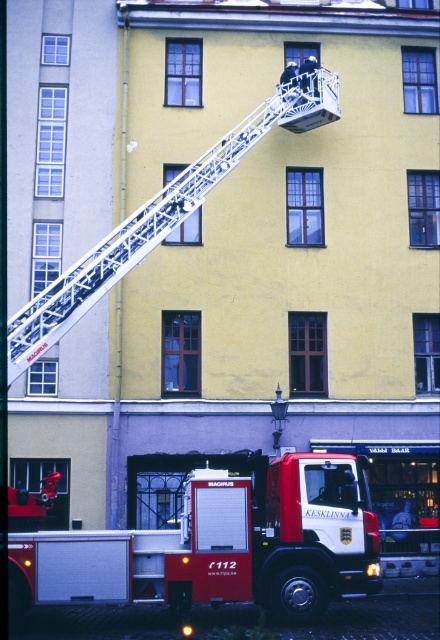
Is red matte fire truck at lower left further to the viewer compared to white metallic ladder at upper center?

Yes, red matte fire truck at lower left is behind white metallic ladder at upper center.

Between point (283, 580) and point (157, 216), which one is positioned behind?

Positioned behind is point (157, 216).

Image resolution: width=440 pixels, height=640 pixels. Describe the element at coordinates (223, 545) in the screenshot. I see `red matte fire truck at lower left` at that location.

This screenshot has height=640, width=440. Find the location of `red matte fire truck at lower left`. red matte fire truck at lower left is located at coordinates (223, 545).